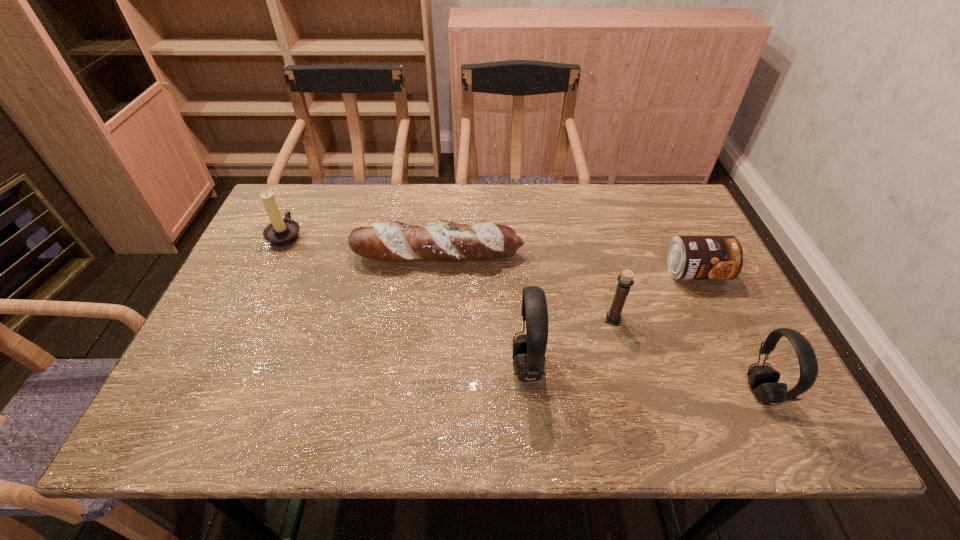
You are a GUI agent. You are given a task and a screenshot of the screen. Output one action in this format:
    pyautogui.click(x=<x>, y=<y>)
    Task: Click on the object that stands as the fourth closest to the nearer candle holder
    
    Given the screenshot: What is the action you would take?
    pyautogui.click(x=763, y=380)

Select which object is the closest to the shorter headset. Please provide its 2D coordinates. Your answer should be formatted as a tuple, i.e. [(x, y)], where the tuple contains the x and y coordinates of a point satisfying the conditions above.

[(688, 257)]

Locate an element on the screen. free space in the image that satisfies the following two spatial constraints: 1. on the back side of the right candle holder; 2. on the wick of the leftmost object is located at coordinates (590, 235).

I want to click on free location that satisfies the following two spatial constraints: 1. on the front label of the can; 2. on the front-facing side of the taller headset, so click(x=740, y=367).

Find the location of a particular element. free spot that satisfies the following two spatial constraints: 1. on the front label of the can; 2. on the front-facing side of the taller headset is located at coordinates (740, 367).

Find the location of a particular element. The height and width of the screenshot is (540, 960). free space that satisfies the following two spatial constraints: 1. on the wick of the baguet; 2. on the left side of the leftmost object is located at coordinates (277, 254).